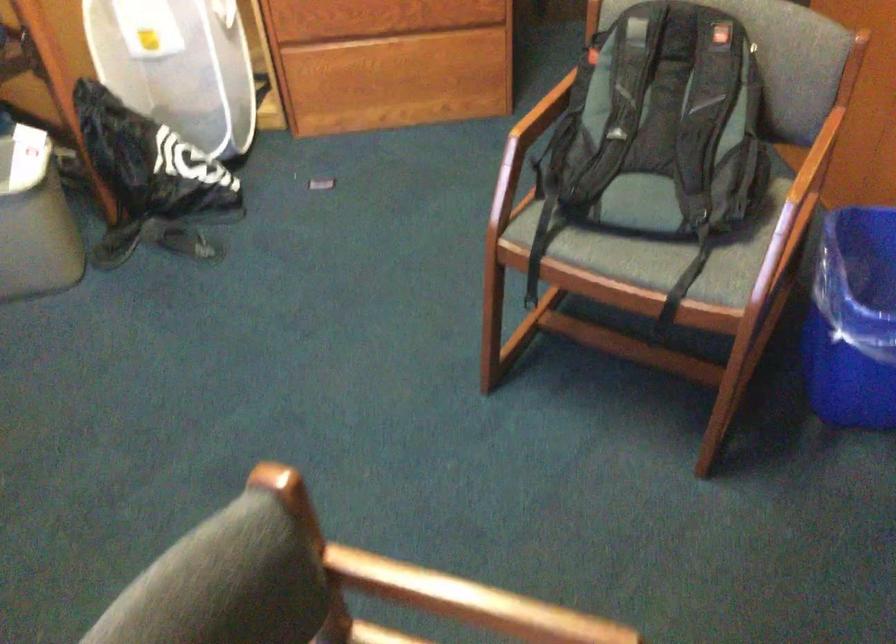
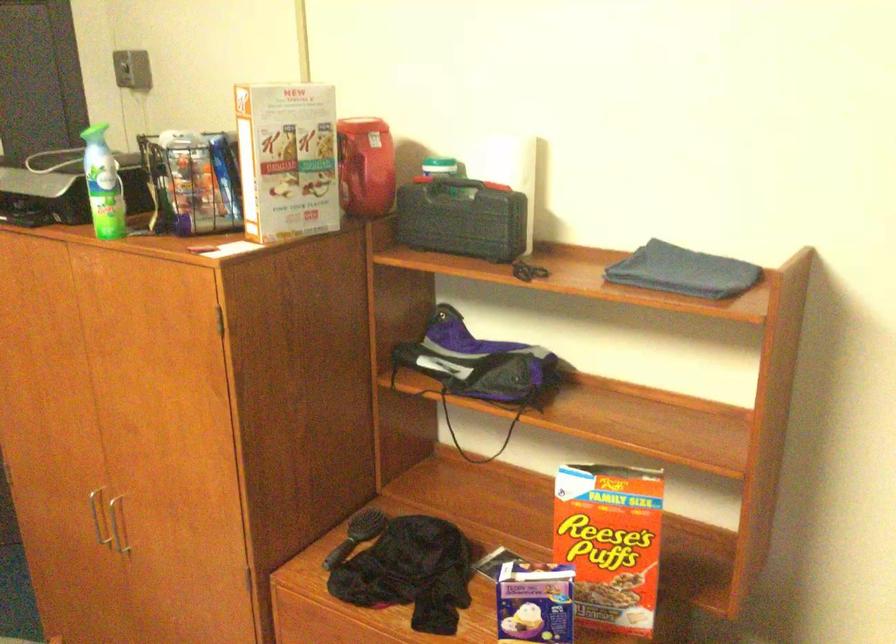
Question: The images are taken continuously from a first-person perspective. In which direction is your viewpoint rotating?

Choices:
 (A) Left
 (B) Right
 (C) Up
 (D) Down

Answer: (B)